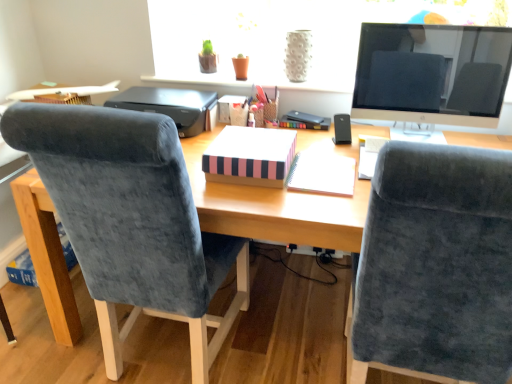
Question: Is white spiral notebook at center, which ranks as the first notebook in right-to-left order, inside black plastic printer at upper center?

Choices:
 (A) yes
 (B) no

Answer: (B)

Question: Can you confirm if black plastic printer at upper center is smaller than white spiral notebook at center, which is the second notebook from left to right?

Choices:
 (A) yes
 (B) no

Answer: (B)

Question: From a real-world perspective, is black plastic printer at upper center below white spiral notebook at center, which ranks as the first notebook in right-to-left order?

Choices:
 (A) no
 (B) yes

Answer: (A)

Question: From the image's perspective, is black plastic printer at upper center over white spiral notebook at center, which ranks as the first notebook in right-to-left order?

Choices:
 (A) yes
 (B) no

Answer: (A)

Question: Is black plastic printer at upper center taller than white spiral notebook at center, which ranks as the first notebook in right-to-left order?

Choices:
 (A) yes
 (B) no

Answer: (A)

Question: Would you say black plastic printer at upper center is outside white spiral notebook at center, which ranks as the first notebook in right-to-left order?

Choices:
 (A) no
 (B) yes

Answer: (B)

Question: Can you confirm if velvet blue chair at left, the 2th chair in the right-to-left sequence, is thinner than black plastic printer at upper center?

Choices:
 (A) yes
 (B) no

Answer: (B)

Question: Can you confirm if velvet blue chair at left, the 2th chair in the right-to-left sequence, is taller than black plastic printer at upper center?

Choices:
 (A) yes
 (B) no

Answer: (A)

Question: Is velvet blue chair at left, the first chair from the left, outside of black plastic printer at upper center?

Choices:
 (A) no
 (B) yes

Answer: (B)

Question: Considering the relative sizes of velvet blue chair at left, the 2th chair in the right-to-left sequence, and black plastic printer at upper center in the image provided, is velvet blue chair at left, the 2th chair in the right-to-left sequence, shorter than black plastic printer at upper center?

Choices:
 (A) no
 (B) yes

Answer: (A)

Question: From the image's perspective, is velvet blue chair at left, the 2th chair in the right-to-left sequence, on top of black plastic printer at upper center?

Choices:
 (A) yes
 (B) no

Answer: (B)

Question: From a real-world perspective, does velvet blue chair at left, the first chair from the left, sit lower than black plastic printer at upper center?

Choices:
 (A) yes
 (B) no

Answer: (A)

Question: Is black plastic printer at upper center to the left of velvet blue chair at right, the 1th chair in the right-to-left sequence, from the viewer's perspective?

Choices:
 (A) yes
 (B) no

Answer: (A)